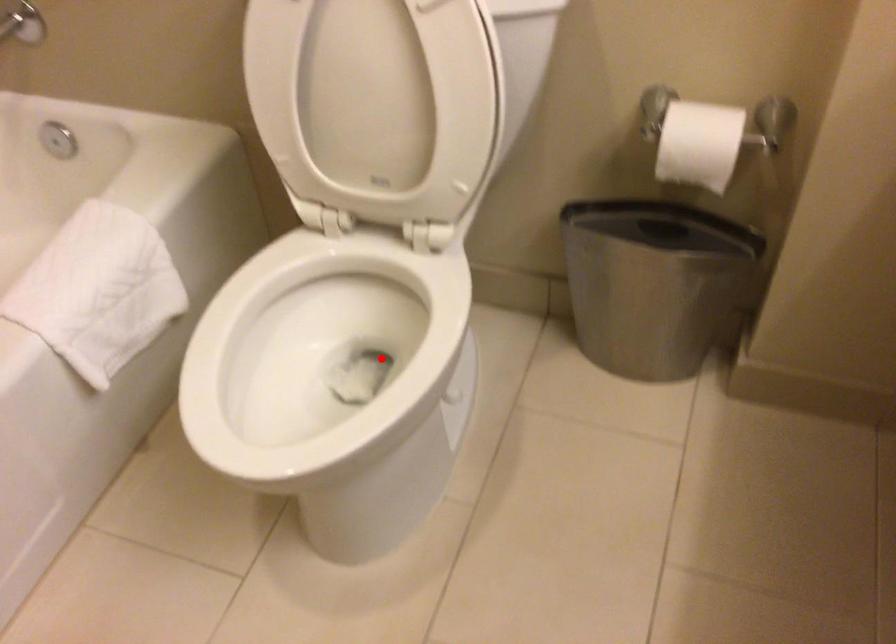
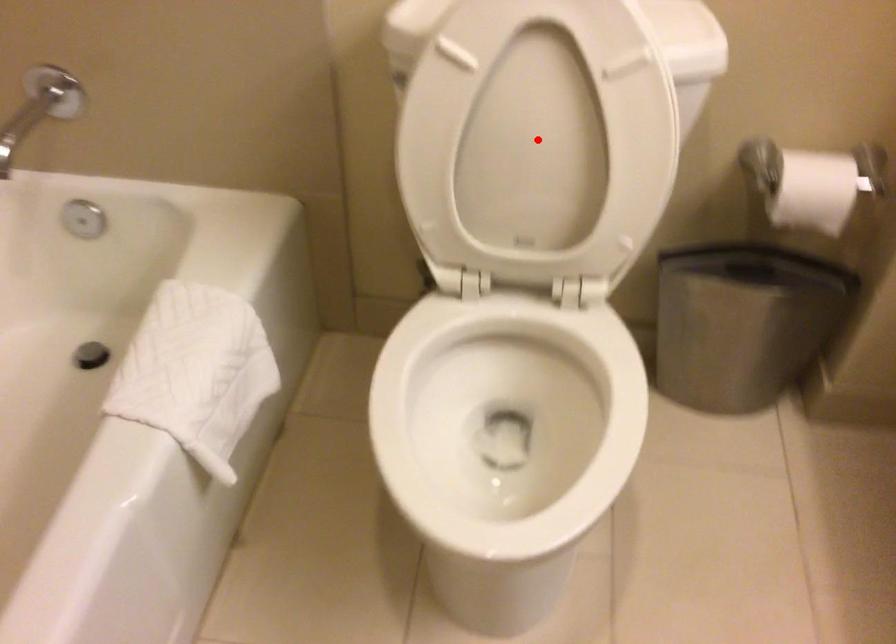
In the scene shown: I am providing you with two images of the same scene from different viewpoints. A red point is marked on the first image and another point is marked on the second image. Is the marked point in image1 the same physical position as the marked point in image2?

No